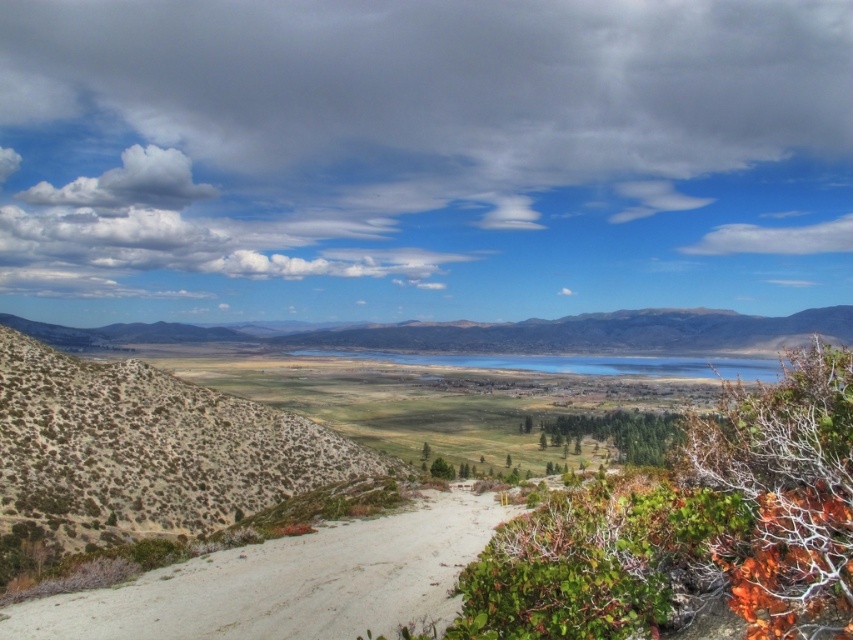
Is green grassy field at center in front of white sandy dirt track at lower left?

Yes, it is.

Is green grassy field at center to the left of white sandy dirt track at lower left from the viewer's perspective?

Yes, green grassy field at center is to the left of white sandy dirt track at lower left.

What do you see at coordinates (252, 422) in the screenshot? I see `green grassy field at center` at bounding box center [252, 422].

You are a GUI agent. You are given a task and a screenshot of the screen. Output one action in this format:
    pyautogui.click(x=<x>, y=<y>)
    Task: Click on the green grassy field at center
    The image size is (853, 640).
    Given the screenshot: What is the action you would take?
    pyautogui.click(x=252, y=422)

How much distance is there between deserted shrubbery at left and rugged brown mountain at center?

deserted shrubbery at left and rugged brown mountain at center are 429.15 meters apart.

Looking at this image, can you confirm if deserted shrubbery at left is positioned to the left of rugged brown mountain at center?

Indeed, deserted shrubbery at left is positioned on the left side of rugged brown mountain at center.

The height and width of the screenshot is (640, 853). I want to click on deserted shrubbery at left, so click(x=138, y=460).

Consider the image. Is white sandy dirt track at lower left shorter than rugged brown mountain at center?

Yes, white sandy dirt track at lower left is shorter than rugged brown mountain at center.

Which is in front, point (337, 630) or point (502, 352)?

Point (337, 630)

Between point (318, 550) and point (189, 330), which one is positioned behind?

Positioned behind is point (189, 330).

You are a GUI agent. You are given a task and a screenshot of the screen. Output one action in this format:
    pyautogui.click(x=<x>, y=<y>)
    Task: Click on the white sandy dirt track at lower left
    The width and height of the screenshot is (853, 640).
    Given the screenshot: What is the action you would take?
    pyautogui.click(x=289, y=582)